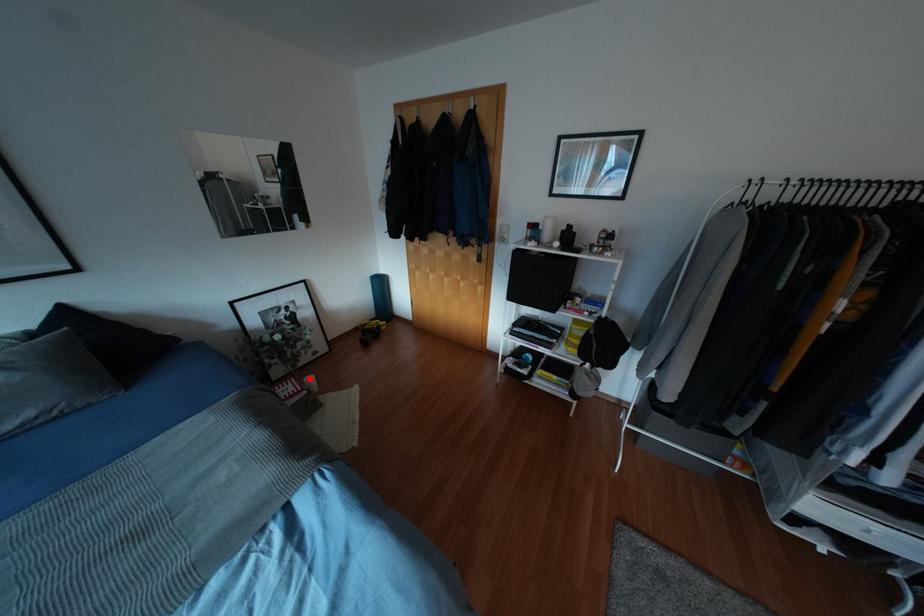
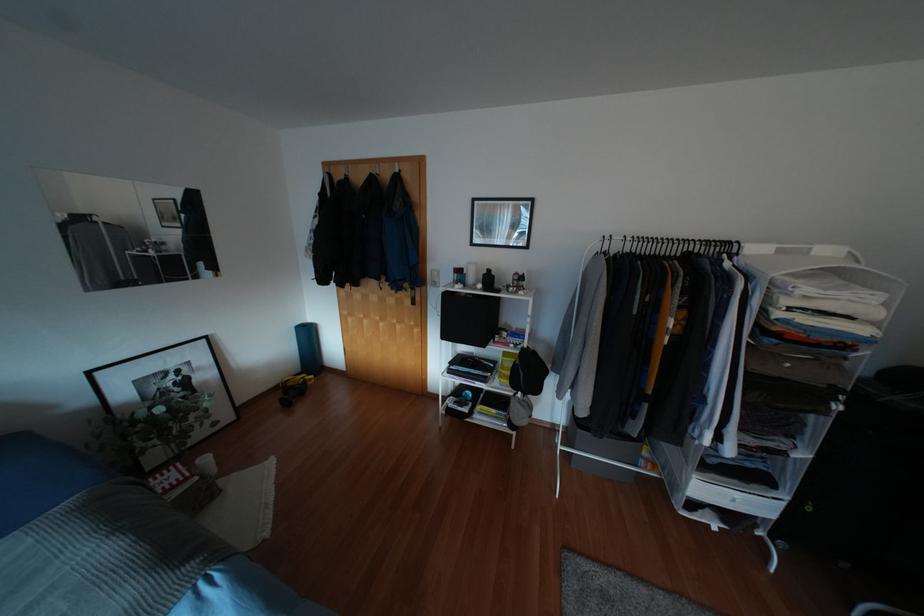
Locate, in the second image, the point that corresponds to the highlighted location in the first image.

(205, 459)